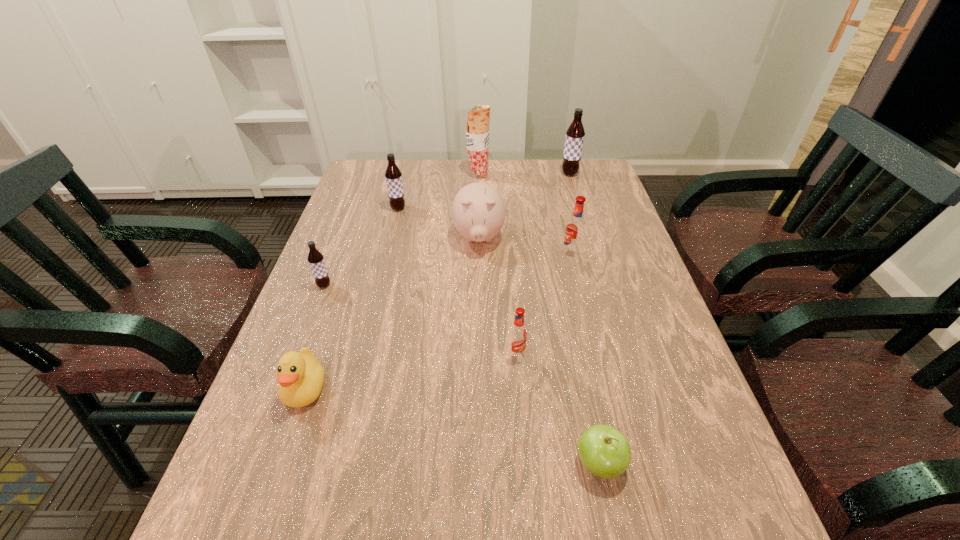
Find the location of a particular element. burrito is located at coordinates (477, 134).

Find the location of `the farthest brown root beer`. the farthest brown root beer is located at coordinates (575, 133).

At what (x,y) coordinates should I click in order to perform the action: click on the rightmost object. Please return your answer as a coordinate pair (x, y). The height and width of the screenshot is (540, 960). Looking at the image, I should click on (575, 133).

Locate an element on the screen. The width and height of the screenshot is (960, 540). the third nearest root beer is located at coordinates (575, 229).

Identify the location of the fourth root beer from left to right. (575, 229).

Locate an element on the screen. the second farthest brown root beer is located at coordinates (393, 175).

Where is `the seventh nearest object`? The width and height of the screenshot is (960, 540). the seventh nearest object is located at coordinates (393, 175).

The width and height of the screenshot is (960, 540). Find the location of `piggy bank`. piggy bank is located at coordinates point(478,211).

What are the coordinates of `the second nearest root beer` in the screenshot? It's located at (316, 260).

I want to click on the nearest brown root beer, so click(x=316, y=260).